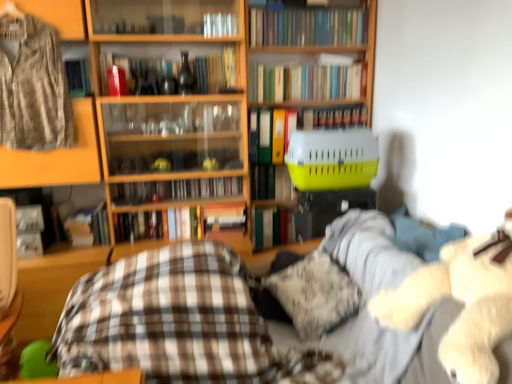
You are a GUI agent. You are given a task and a screenshot of the screen. Output one action in this format:
    pyautogui.click(x=<x>, y=<y>)
    Task: Click on the free space above hardcover book at center, the 2th book in the bottom-to-top sequence (from a real-world perspective)
    The image size is (512, 384).
    Given the screenshot: What is the action you would take?
    (x=273, y=204)